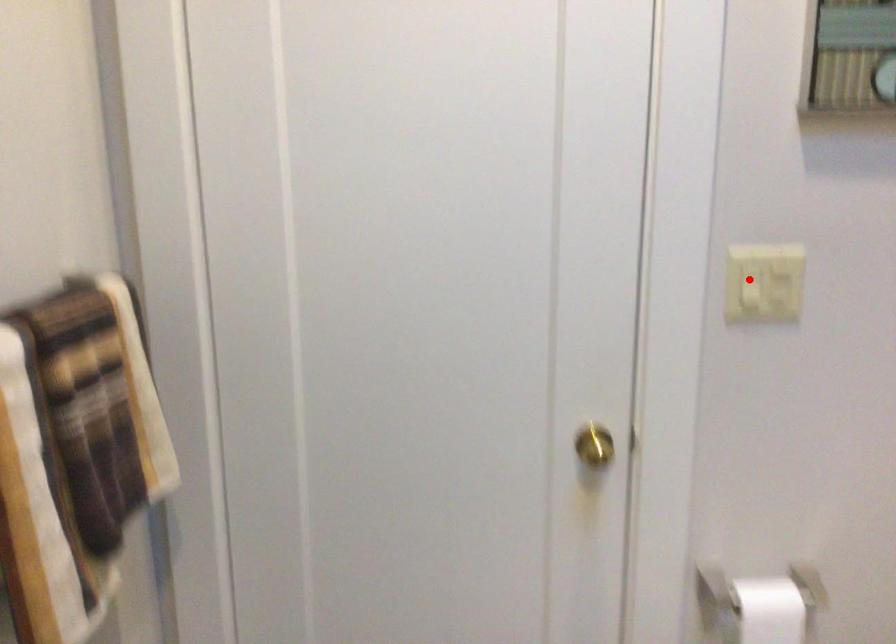
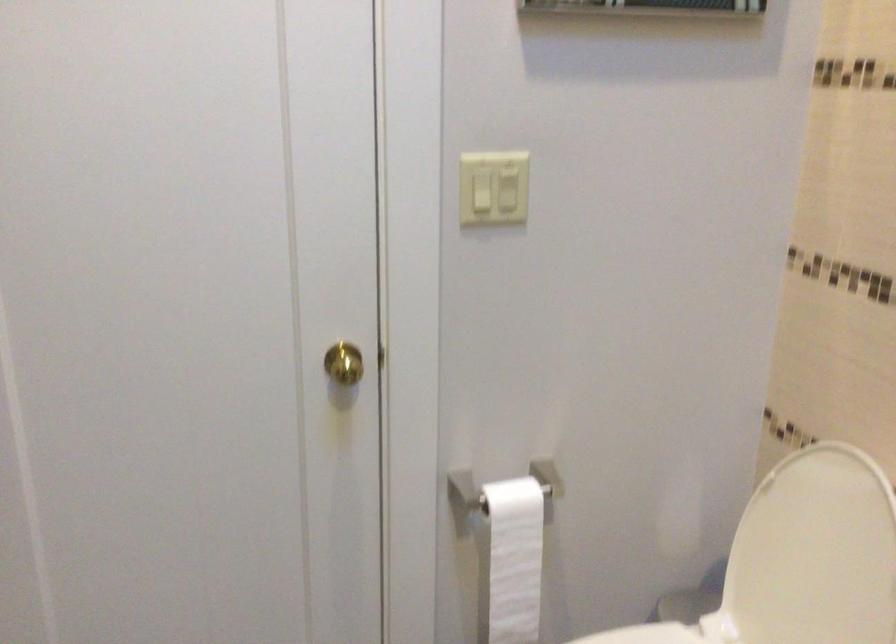
Locate, in the second image, the point that corresponds to the highlighted location in the first image.

(480, 191)